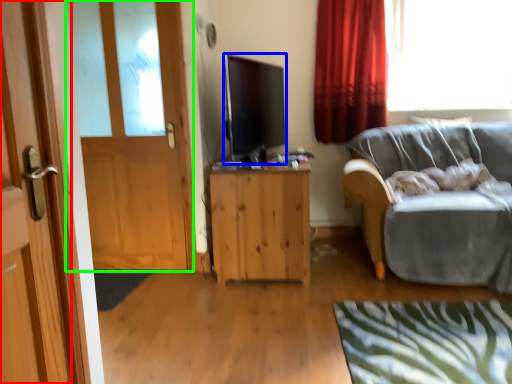
Question: Estimate the real-world distances between objects in this image. Which object is farther from door (highlighted by a red box), television (highlighted by a blue box) or door (highlighted by a green box)?

Choices:
 (A) television
 (B) door

Answer: (A)